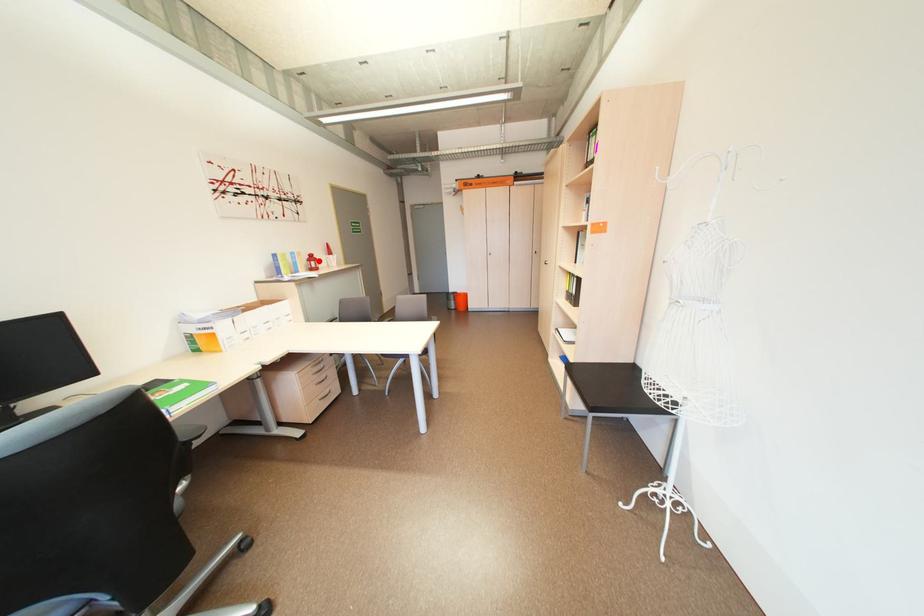
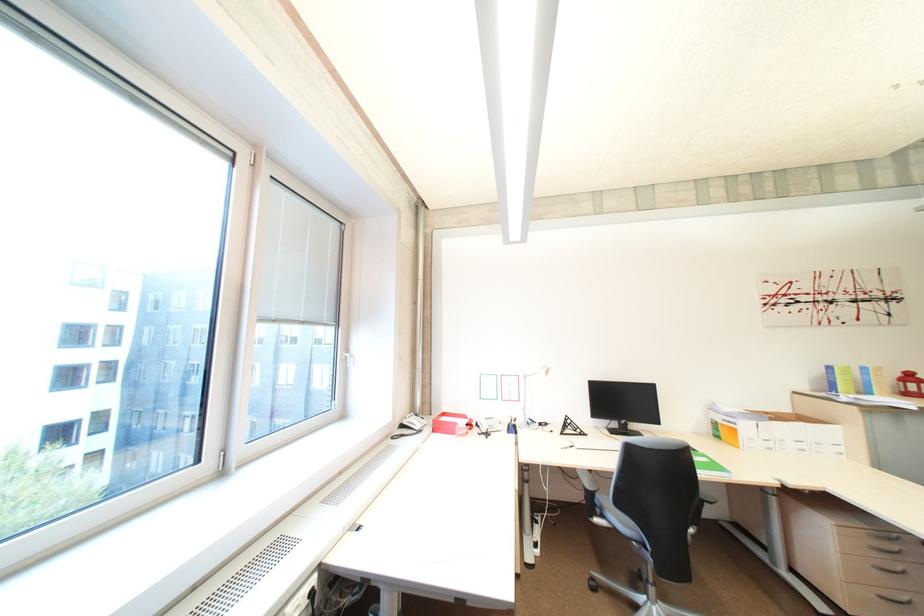
Where in the second image is the point corresponding to the highlighted location from the first image?

(913, 382)